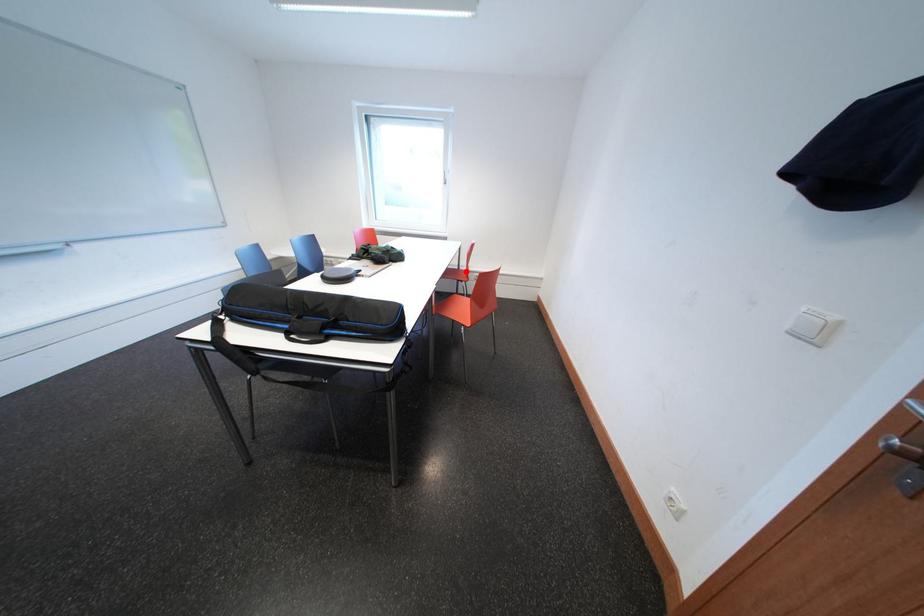
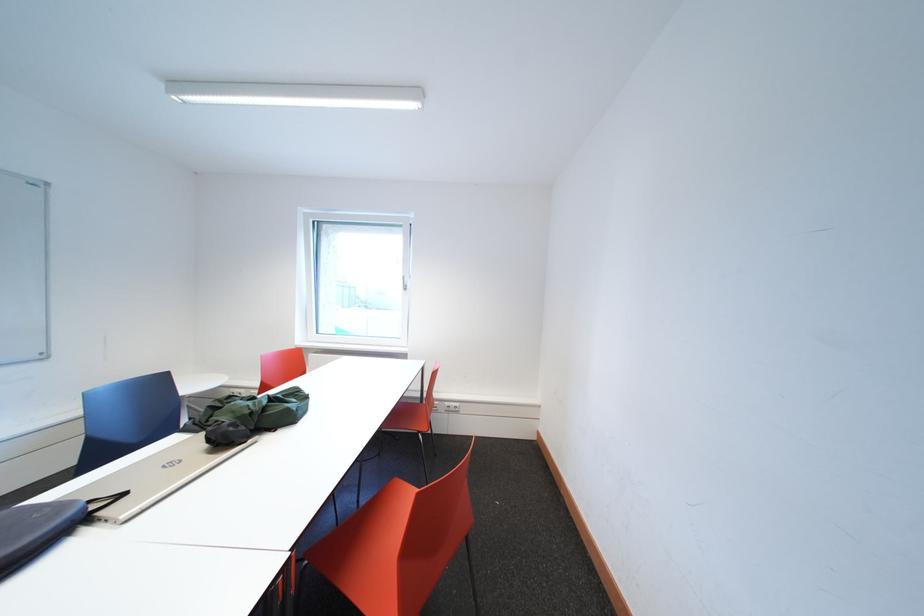
Question: A red point is marked in image1. In image2, is the corresponding 3D point closer to the camera or farther? Reply with the corresponding letter.

Choices:
 (A) The corresponding 3D point is closer.
 (B) The corresponding 3D point is farther.

Answer: (B)